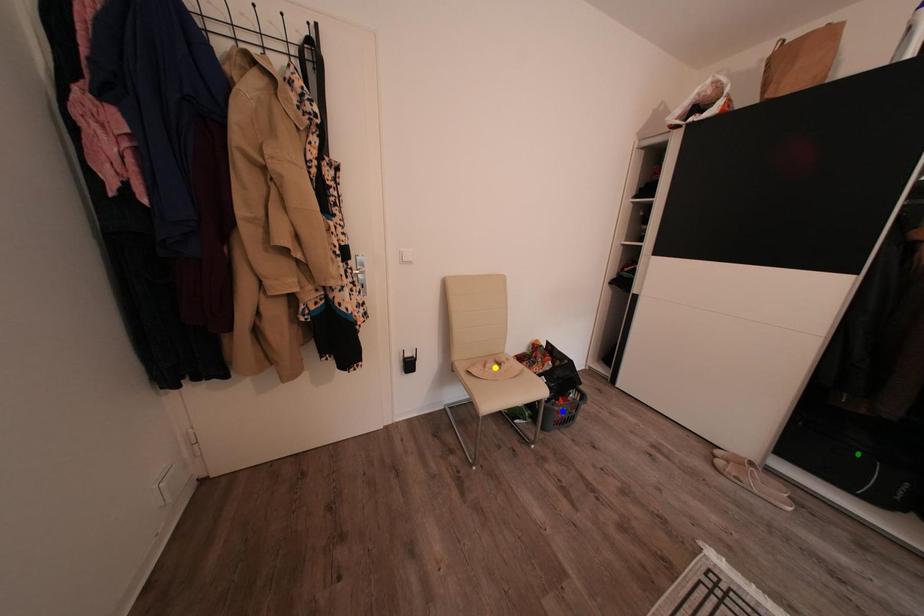
Order these from farthest to nearest:
- blue point
- yellow point
- green point

yellow point < blue point < green point